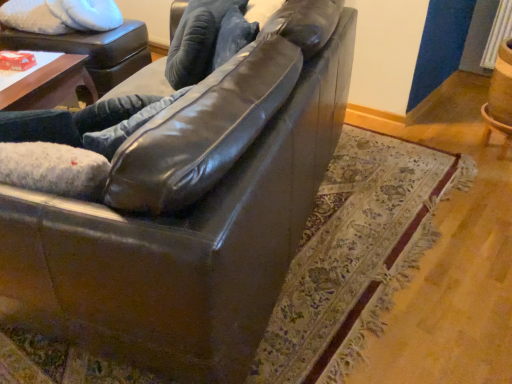
Question: In terms of size, does matte black swivel chair at upper left appear bigger or smaller than shiny brown leather couch at center?

Choices:
 (A) big
 (B) small

Answer: (B)

Question: In the image, is matte black swivel chair at upper left on the left side or the right side of shiny brown leather couch at center?

Choices:
 (A) right
 (B) left

Answer: (B)

Question: Which is farther from the matte black swivel chair at upper left?

Choices:
 (A) shiny black leather couch at center
 (B) shiny brown leather couch at center

Answer: (B)

Question: Based on their relative distances, which object is farther from the shiny black leather couch at center?

Choices:
 (A) matte black swivel chair at upper left
 (B) shiny brown leather couch at center

Answer: (A)